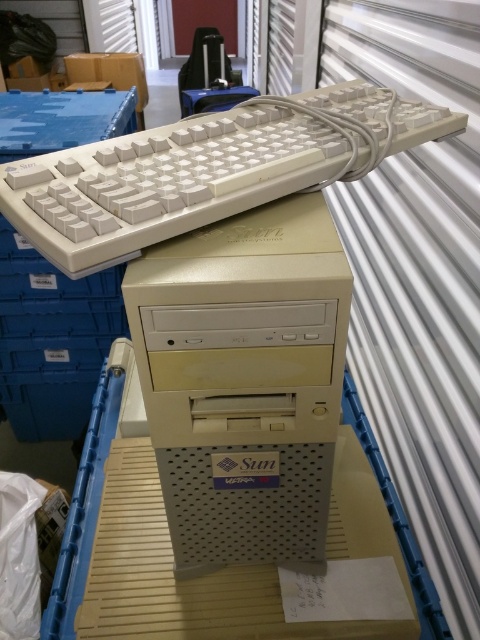
Which of these two, beige plastic computer tower at center or white plastic computer desk at center, stands shorter?

With less height is white plastic computer desk at center.

Which is below, beige plastic computer tower at center or white plastic computer desk at center?

white plastic computer desk at center is lower down.

Describe the element at coordinates (243, 380) in the screenshot. This screenshot has width=480, height=640. I see `beige plastic computer tower at center` at that location.

Find the location of a particular element. beige plastic computer tower at center is located at coordinates (243, 380).

Consider the image. Could you measure the distance between white plastic keyboard at upper center and white plastic computer desk at center?

white plastic keyboard at upper center and white plastic computer desk at center are 19.99 inches apart from each other.

Can you confirm if white plastic keyboard at upper center is positioned above white plastic computer desk at center?

Correct, white plastic keyboard at upper center is located above white plastic computer desk at center.

Identify the location of white plastic keyboard at upper center. Image resolution: width=480 pixels, height=640 pixels. (206, 170).

Can you confirm if beige plastic computer tower at center is positioned below white plastic keyboard at upper center?

Indeed, beige plastic computer tower at center is positioned under white plastic keyboard at upper center.

Who is more forward, (292, 339) or (262, 195)?

Point (292, 339)

Where is `beige plastic computer tower at center`? This screenshot has height=640, width=480. beige plastic computer tower at center is located at coordinates (243, 380).

You are a GUI agent. You are given a task and a screenshot of the screen. Output one action in this format:
    pyautogui.click(x=<x>, y=<y>)
    Task: Click on the beige plastic computer tower at center
    
    Given the screenshot: What is the action you would take?
    pyautogui.click(x=243, y=380)